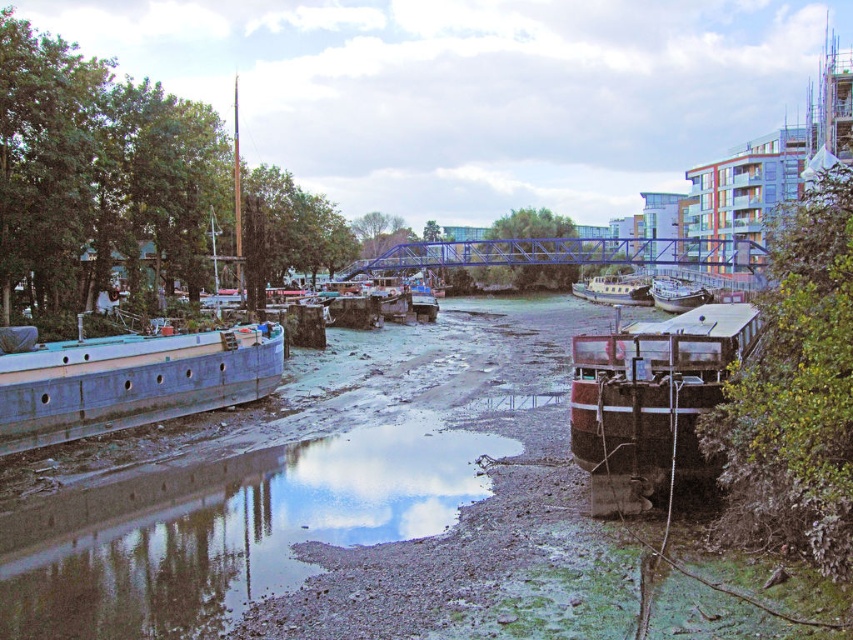
Question: Estimate the real-world distances between objects in this image. Which object is closer to the blue matte barge at left?

Choices:
 (A) wooden boat at right
 (B) wooden polished boat at center

Answer: (A)

Question: Which point appears closest to the camera in this image?

Choices:
 (A) (717, 372)
 (B) (223, 556)

Answer: (B)

Question: Observing the image, what is the correct spatial positioning of muddy gravel river at center in reference to rustic wooden barge at right?

Choices:
 (A) left
 (B) right

Answer: (A)

Question: Estimate the real-world distances between objects in this image. Which object is farther from the wooden boat at right?

Choices:
 (A) rustic wooden barge at right
 (B) wooden polished boat at center
 (C) muddy gravel river at center
 (D) blue matte barge at left

Answer: (C)

Question: Does muddy gravel river at center appear on the right side of blue matte barge at left?

Choices:
 (A) yes
 (B) no

Answer: (A)

Question: Is muddy gravel river at center smaller than blue matte barge at left?

Choices:
 (A) yes
 (B) no

Answer: (A)